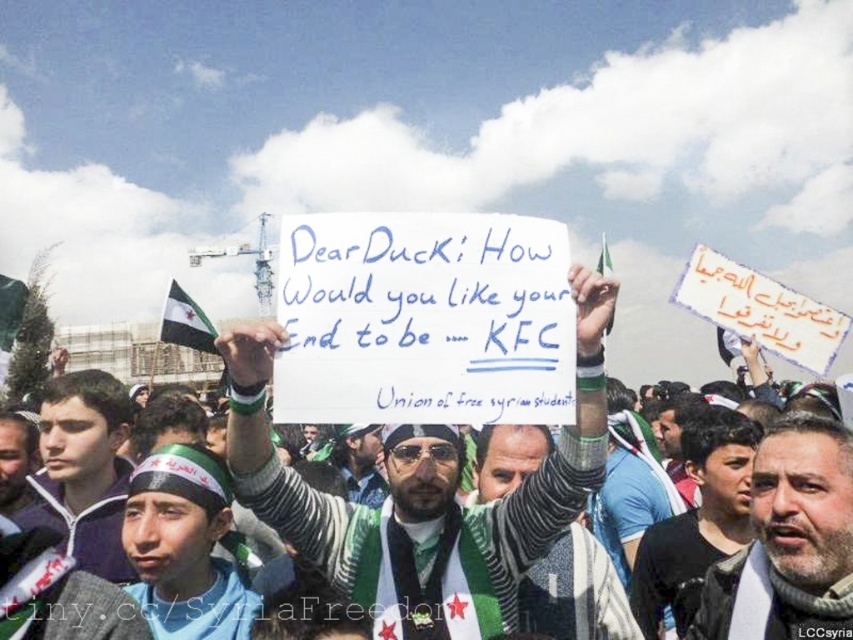
Question: Is striped sweater at center smaller than gray beard at center?

Choices:
 (A) no
 (B) yes

Answer: (A)

Question: Is striped sweater at center smaller than gray beard at center?

Choices:
 (A) no
 (B) yes

Answer: (A)

Question: Is striped sweater at center closer to camera compared to gray beard at center?

Choices:
 (A) yes
 (B) no

Answer: (A)

Question: Which of the following is the closest to the observer?

Choices:
 (A) gray beard at center
 (B) striped sweater at center

Answer: (B)